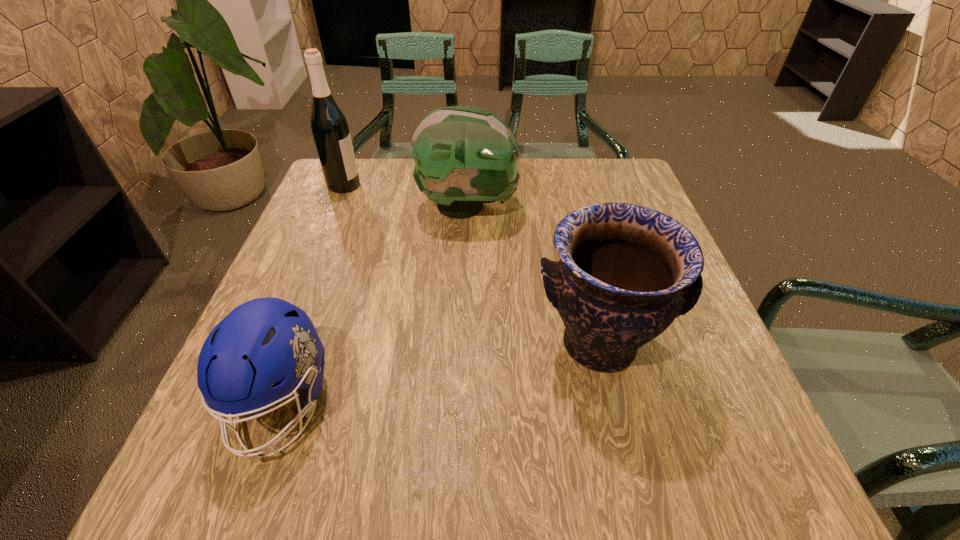
Where is `football helmet at the far edge`? football helmet at the far edge is located at coordinates (464, 156).

You are a GUI agent. You are given a task and a screenshot of the screen. Output one action in this format:
    pyautogui.click(x=<x>, y=<y>)
    Task: Click on the object that is at the near edge
    The height and width of the screenshot is (540, 960).
    Given the screenshot: What is the action you would take?
    pyautogui.click(x=263, y=341)

This screenshot has width=960, height=540. Find the location of `wine bottle positioned at the left edge`. wine bottle positioned at the left edge is located at coordinates (330, 130).

I want to click on football helmet that is at the left edge, so click(263, 341).

You are a GUI agent. You are given a task and a screenshot of the screen. Output one action in this format:
    pyautogui.click(x=<x>, y=<y>)
    Task: Click on the object located at the right edge
    
    Given the screenshot: What is the action you would take?
    pyautogui.click(x=625, y=272)

At what (x,y) coordinates should I click in order to perform the action: click on object at the far left corner. Please return your answer as a coordinate pair (x, y). The image size is (960, 540). Looking at the image, I should click on pyautogui.click(x=330, y=130).

Image resolution: width=960 pixels, height=540 pixels. I want to click on object positioned at the near left corner, so click(x=263, y=341).

Find the location of a particular element. free spot at the far edge of the desktop is located at coordinates (573, 181).

This screenshot has width=960, height=540. In the image, there is a desktop. What are the coordinates of `vacant space at the left edge` in the screenshot? It's located at (331, 313).

Where is `vacant area at the far left corner of the desktop`? The height and width of the screenshot is (540, 960). vacant area at the far left corner of the desktop is located at coordinates (370, 166).